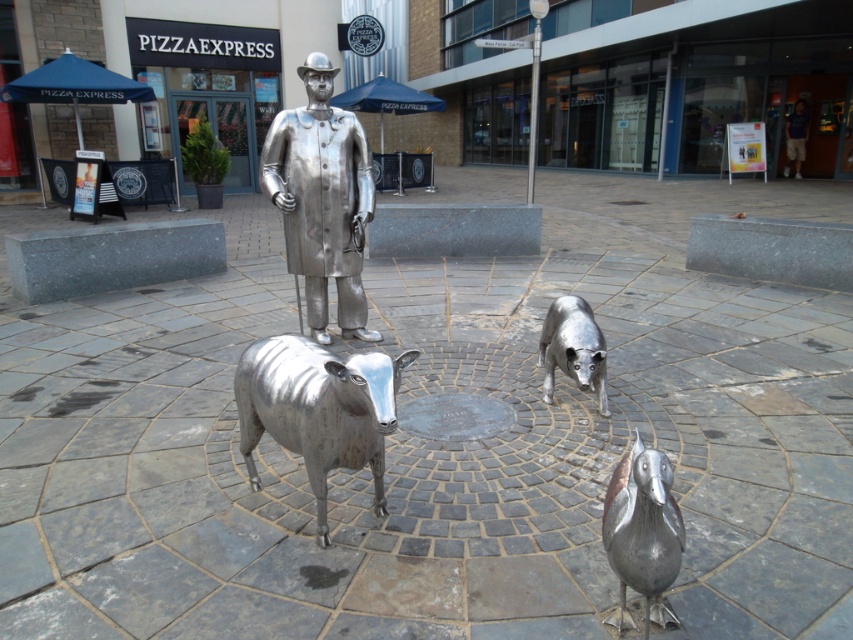
Is brushed metal sheep at center bigger than brushed metal duck at lower right?

Yes.

Does point (294, 451) come farther from viewer compared to point (659, 616)?

Yes, it is.

Where is `brushed metal sheep at center`? Image resolution: width=853 pixels, height=640 pixels. brushed metal sheep at center is located at coordinates (318, 410).

Between polished silver statue at center and brushed metal sheep at center, which one has more height?

polished silver statue at center

Does polished silver statue at center appear on the right side of brushed metal sheep at center?

In fact, polished silver statue at center is to the left of brushed metal sheep at center.

You are a GUI agent. You are given a task and a screenshot of the screen. Output one action in this format:
    pyautogui.click(x=<x>, y=<y>)
    Task: Click on the polished silver statue at center
    The image size is (853, 640).
    Given the screenshot: What is the action you would take?
    pyautogui.click(x=322, y=198)

Identify the location of polished silver statue at center. (322, 198).

Does polished silver statue at center lie behind brushed metal dog at center?

Yes, it is.

Can you confirm if polished silver statue at center is positioned above brushed metal dog at center?

Yes, polished silver statue at center is above brushed metal dog at center.

Does point (360, 131) lie in front of point (589, 314)?

No, it is behind (589, 314).

Find the location of a particular element. polished silver statue at center is located at coordinates (322, 198).